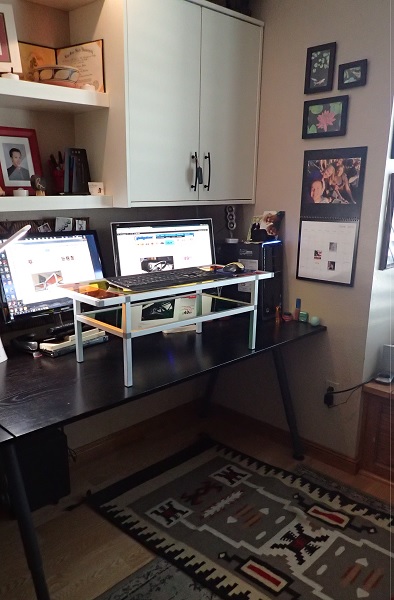
This screenshot has width=394, height=600. Find the location of `electrical outlet`. electrical outlet is located at coordinates (333, 390).